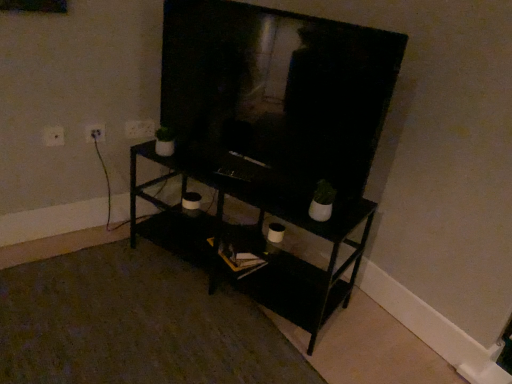
Question: In the image, is black matte shelf at center positioned in front of or behind white plastic electric outlet at upper left, the 1th electric outlet when ordered from left to right?

Choices:
 (A) behind
 (B) front

Answer: (B)

Question: Considering the positions of black matte shelf at center and white plastic electric outlet at upper left, the 1th electric outlet when ordered from left to right, in the image, is black matte shelf at center bigger or smaller than white plastic electric outlet at upper left, the 1th electric outlet when ordered from left to right,?

Choices:
 (A) small
 (B) big

Answer: (B)

Question: Estimate the real-world distances between objects in this image. Which object is closer to the white plastic electric outlet at upper left, the 1th electric outlet from the right?

Choices:
 (A) white plastic electric outlet at upper left, the 3th electric outlet when ordered from back to front
 (B) white plastic electric outlet at upper left, acting as the 2th electric outlet starting from the front
 (C) black matte shelf at center

Answer: (B)

Question: Which object is positioned farthest from the white plastic electric outlet at upper left, which ranks as the first electric outlet in front-to-back order?

Choices:
 (A) black matte shelf at center
 (B) white plastic electric outlet at upper left, the second electric outlet positioned from the left
 (C) white plastic electric outlet at upper left, which is counted as the first electric outlet, starting from the back

Answer: (A)